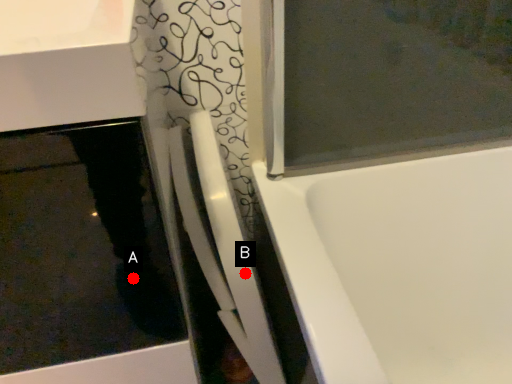
Question: Two points are circled on the image, labeled by A and B beside each circle. Which of the following is the farthest from the observer?

Choices:
 (A) A is further
 (B) B is further

Answer: (B)